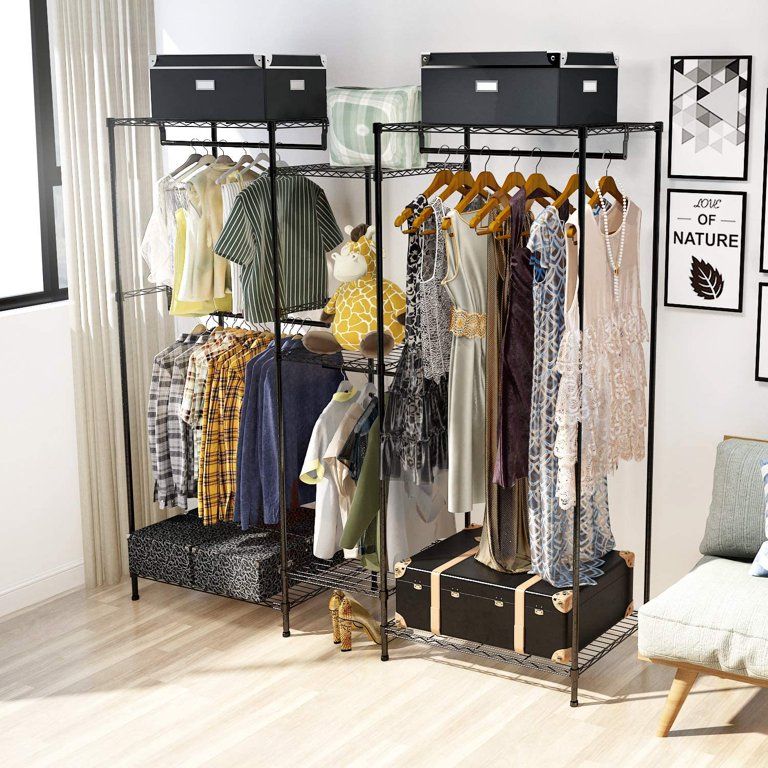
At what (x,y) coordinates should I click in order to perform the action: click on hinges. Please return your answer as a coordinate pair (x, y). Looking at the image, I should click on (415, 584), (455, 591), (495, 603), (538, 610).